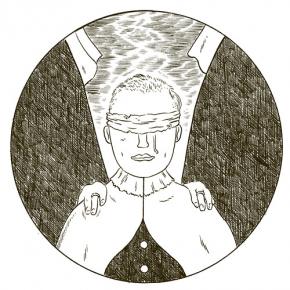
The image size is (290, 290). I want to click on circle art piece, so click(218, 126).